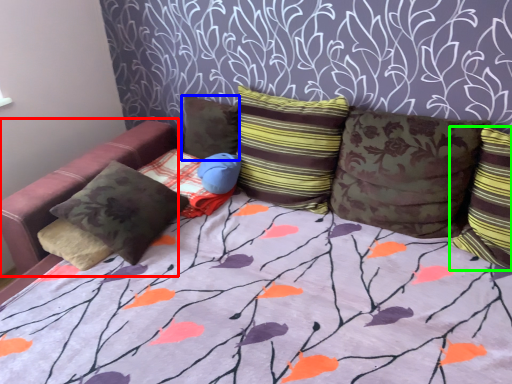
Question: Which is nearer to the bean bag chair (highlighted by a red box)? pillow (highlighted by a blue box) or pillow (highlighted by a green box).

Choices:
 (A) pillow
 (B) pillow

Answer: (A)